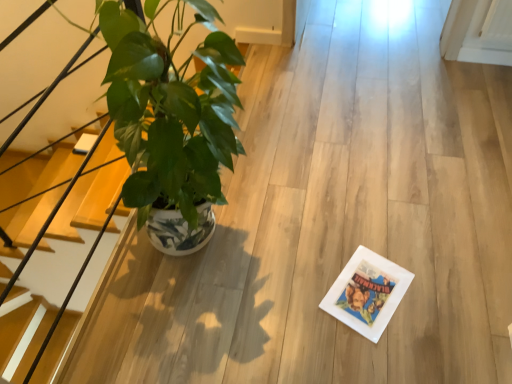
Question: From a real-world perspective, is wooden at left positioned above or below green glossy plant at left?

Choices:
 (A) above
 (B) below

Answer: (B)

Question: From the image's perspective, relative to green glossy plant at left, is wooden at left above or below?

Choices:
 (A) above
 (B) below

Answer: (B)

Question: In the image, is wooden at left on the left side or the right side of green glossy plant at left?

Choices:
 (A) left
 (B) right

Answer: (A)

Question: In the image, is green glossy plant at left on the left side or the right side of wooden at left?

Choices:
 (A) right
 (B) left

Answer: (A)

Question: Is green glossy plant at left wider or thinner than wooden at left?

Choices:
 (A) wide
 (B) thin

Answer: (A)

Question: Looking at the image, does green glossy plant at left seem bigger or smaller compared to wooden at left?

Choices:
 (A) big
 (B) small

Answer: (A)

Question: From a real-world perspective, is green glossy plant at left positioned above or below wooden at left?

Choices:
 (A) below
 (B) above

Answer: (B)